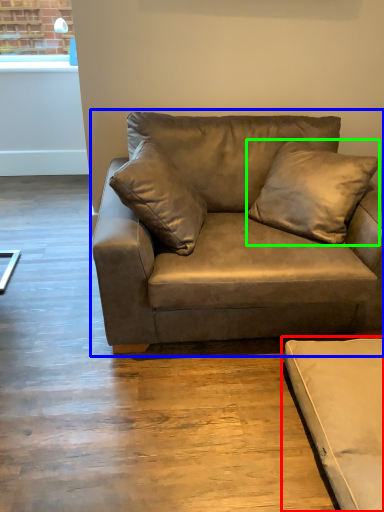
Question: Which object is the closest to the studio couch (highlighted by a red box)? Choose among these: studio couch (highlighted by a blue box) or pillow (highlighted by a green box).

Choices:
 (A) studio couch
 (B) pillow

Answer: (A)